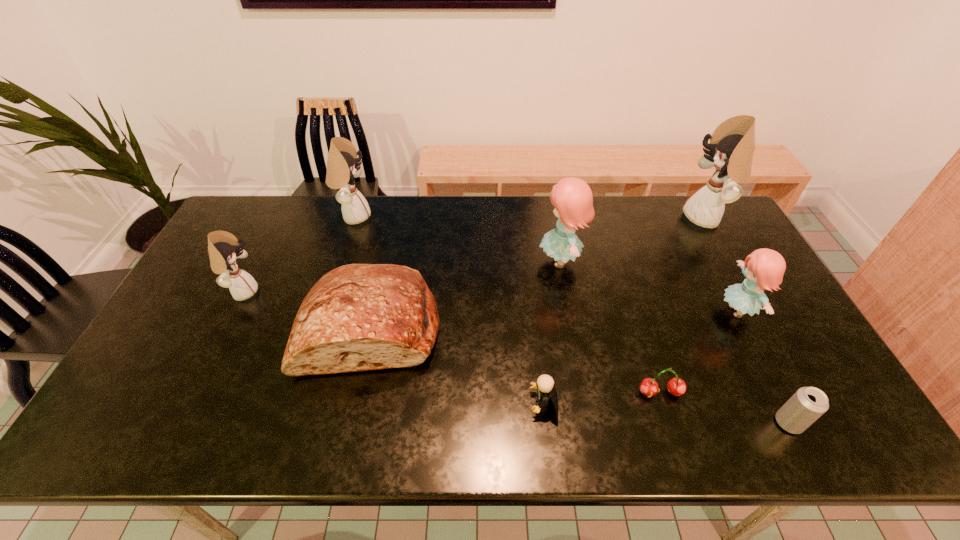
Identify the location of vacant space that satisfies the following two spatial constraints: 1. on the front-facing side of the left blue doll; 2. at the sliced front of the fourth shortest object. (572, 328).

I want to click on blank space that satisfies the following two spatial constraints: 1. at the sliced front of the bread; 2. on the left side of the beer can, so click(x=350, y=423).

I want to click on blank area in the image that satisfies the following two spatial constraints: 1. on the front-facing side of the right blue doll; 2. with stems pointing upwards on the cherry, so click(780, 393).

Find the location of a particular element. vacant space that satisfies the following two spatial constraints: 1. on the front-facing side of the left blue doll; 2. on the left side of the beer can is located at coordinates (589, 423).